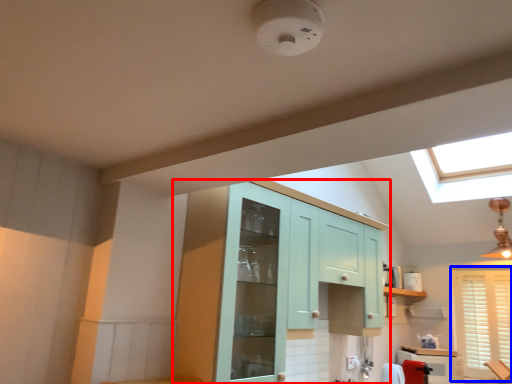
Question: Which object is further to the camera taking this photo, cabinetry (highlighted by a red box) or window (highlighted by a blue box)?

Choices:
 (A) cabinetry
 (B) window

Answer: (B)